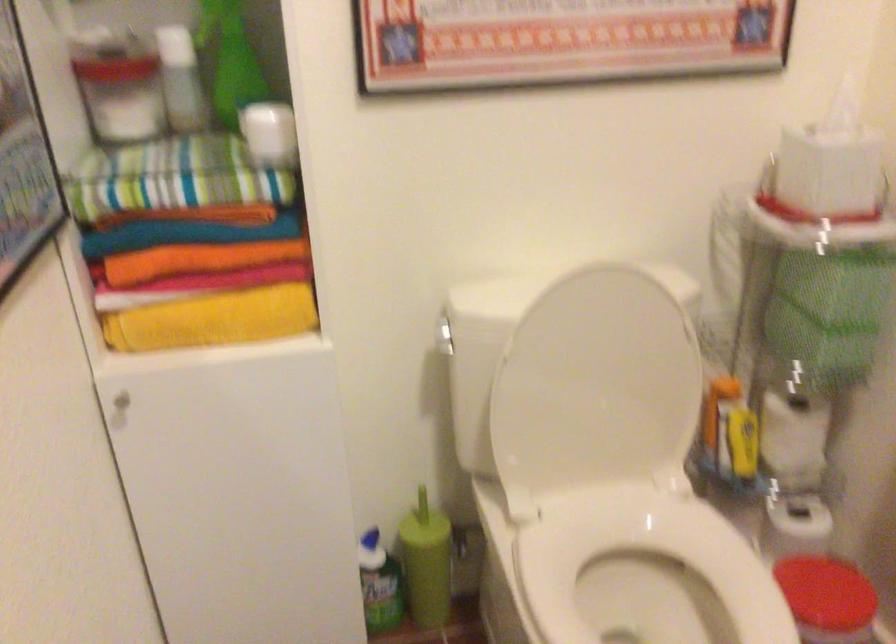
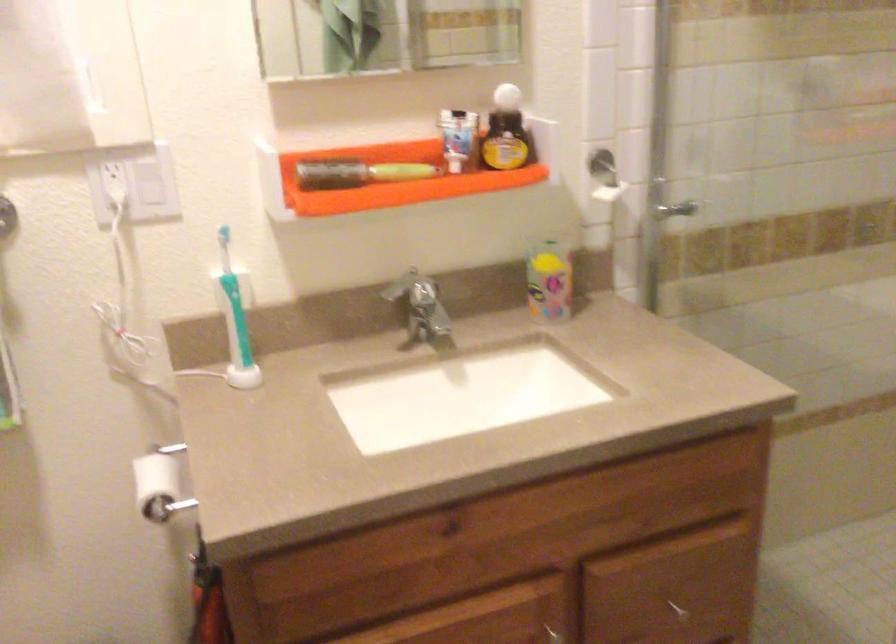
First-person continuous shooting, in which direction is the camera rotating?

The rotation direction of the camera is right-down.